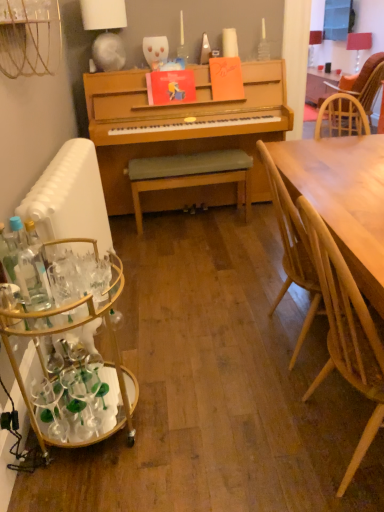
Question: Can you confirm if matte white lampshade at upper right, the 2th lamp viewed from the left, is shorter than translucent glass bottle at left, which ranks as the second bottle in right-to-left order?

Choices:
 (A) yes
 (B) no

Answer: (B)

Question: Is matte white lampshade at upper right, which is the third lamp from front to back, oriented towards translucent glass bottle at left, the 1th bottle viewed from the left?

Choices:
 (A) no
 (B) yes

Answer: (A)

Question: Is matte white lampshade at upper right, which is the third lamp from front to back, placed right next to translucent glass bottle at left, which ranks as the second bottle in right-to-left order?

Choices:
 (A) yes
 (B) no

Answer: (B)

Question: Does matte white lampshade at upper right, the 2th lamp in the right-to-left sequence, have a smaller size compared to translucent glass bottle at left, which ranks as the second bottle in right-to-left order?

Choices:
 (A) no
 (B) yes

Answer: (A)

Question: From a real-world perspective, is matte white lampshade at upper right, which ranks as the 1th lamp in back-to-front order, physically above translucent glass bottle at left, which ranks as the second bottle in right-to-left order?

Choices:
 (A) no
 (B) yes

Answer: (B)

Question: Is matte white lampshade at upper right, the first lamp in the top-to-bottom sequence, bigger than translucent glass bottle at left, the 1th bottle viewed from the left?

Choices:
 (A) no
 (B) yes

Answer: (B)

Question: From the image's perspective, would you say red fabric lampshade at upper right, which is counted as the second lamp, starting from the back, is shown under matte white lampshade at upper right, which is the third lamp from front to back?

Choices:
 (A) yes
 (B) no

Answer: (A)

Question: Is red fabric lampshade at upper right, which appears as the second lamp when ordered from the bottom, turned away from matte white lampshade at upper right, which is the third lamp from front to back?

Choices:
 (A) no
 (B) yes

Answer: (A)

Question: Would you say red fabric lampshade at upper right, which appears as the second lamp when ordered from the bottom, is a long distance from matte white lampshade at upper right, the 2th lamp in the right-to-left sequence?

Choices:
 (A) no
 (B) yes

Answer: (A)

Question: Considering the relative sizes of red fabric lampshade at upper right, the 2th lamp from the front, and matte white lampshade at upper right, the first lamp in the top-to-bottom sequence, in the image provided, is red fabric lampshade at upper right, the 2th lamp from the front, bigger than matte white lampshade at upper right, the first lamp in the top-to-bottom sequence,?

Choices:
 (A) yes
 (B) no

Answer: (A)

Question: Is red fabric lampshade at upper right, which is counted as the second lamp, starting from the back, shorter than matte white lampshade at upper right, the 2th lamp viewed from the left?

Choices:
 (A) no
 (B) yes

Answer: (B)

Question: Is matte white lampshade at upper right, which is the third lamp from front to back, a part of red fabric lampshade at upper right, the 3th lamp viewed from the left?

Choices:
 (A) yes
 (B) no

Answer: (B)

Question: Is matte white lampshade at upper right, the 2th lamp in the right-to-left sequence, bigger than red fabric lampshade at upper right, which appears as the second lamp when ordered from the bottom?

Choices:
 (A) yes
 (B) no

Answer: (B)